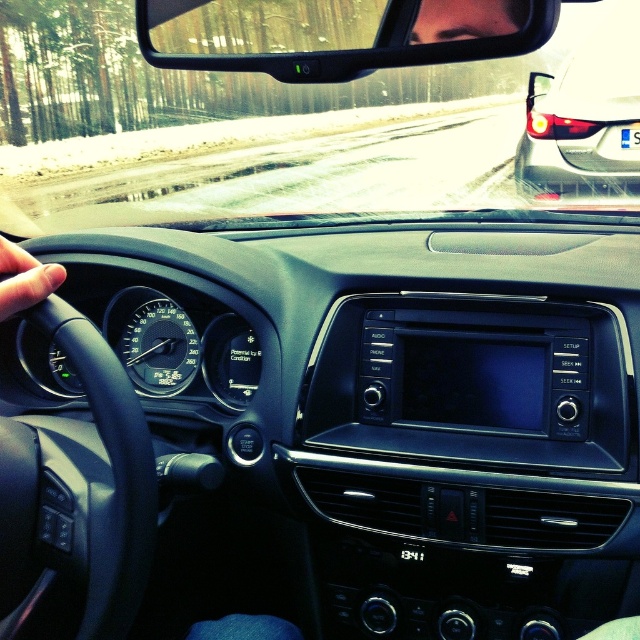
Question: Does transparent glass windshield at center have a larger size compared to clear plastic view mirror at upper center?

Choices:
 (A) no
 (B) yes

Answer: (B)

Question: Which point is farther to the camera?

Choices:
 (A) black matte steering wheel at left
 (B) black rubber steering wheel at left
 (C) clear plastic view mirror at upper center

Answer: (B)

Question: Which point appears closest to the camera in this image?

Choices:
 (A) (264, 49)
 (B) (36, 284)
 (C) (116, 550)

Answer: (B)

Question: Is transparent glass windshield at center to the right of matte black car at upper right from the viewer's perspective?

Choices:
 (A) no
 (B) yes

Answer: (A)

Question: Estimate the real-world distances between objects in this image. Which object is closer to the matte black car at upper right?

Choices:
 (A) transparent glass windshield at center
 (B) black rubber steering wheel at left

Answer: (A)

Question: Does clear plastic view mirror at upper center appear on the right side of black matte steering wheel at left?

Choices:
 (A) yes
 (B) no

Answer: (A)